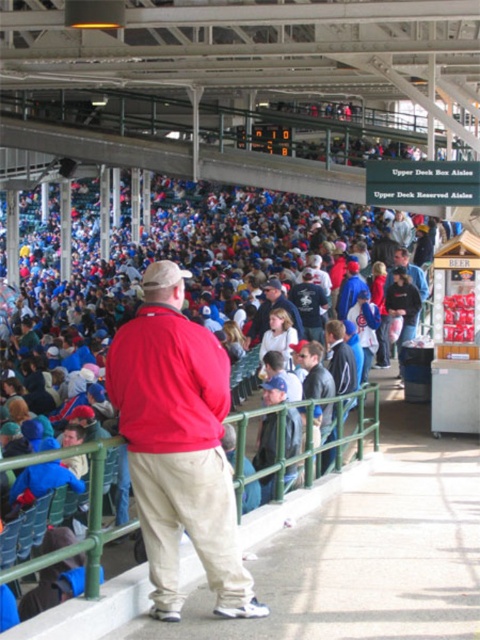
You are standing at the point labeled point [104,628] and want to move to the point labeled point [305,368]. Which direction should you move to get closer to the baseball field?

Since point [104,628] is closer to the viewer than point [305,368], you should move towards point [305,368] to get closer to the baseball field.

You are standing at the point labeled point (x=268, y=454) in the baseball stadium. You want to move to the point labeled point (x=160, y=260). Is there a clear path between these two points?

Point (x=160, y=260) is behind point (x=268, y=454), so there is no clear path between them because the point you want to reach is located behind the other point, possibly blocked by obstacles like seats or spectators.

You are a photographer at the baseball stadium and want to capture a photo of the man wearing the matte red jacket at center and blue denim jeans at center. To ensure both items are clearly visible in the frame, which one should you focus on first?

The matte red jacket at center is shorter than blue denim jeans at center. Therefore, you should focus on the blue denim jeans at center first since it is taller and will be more prominent in the photo.